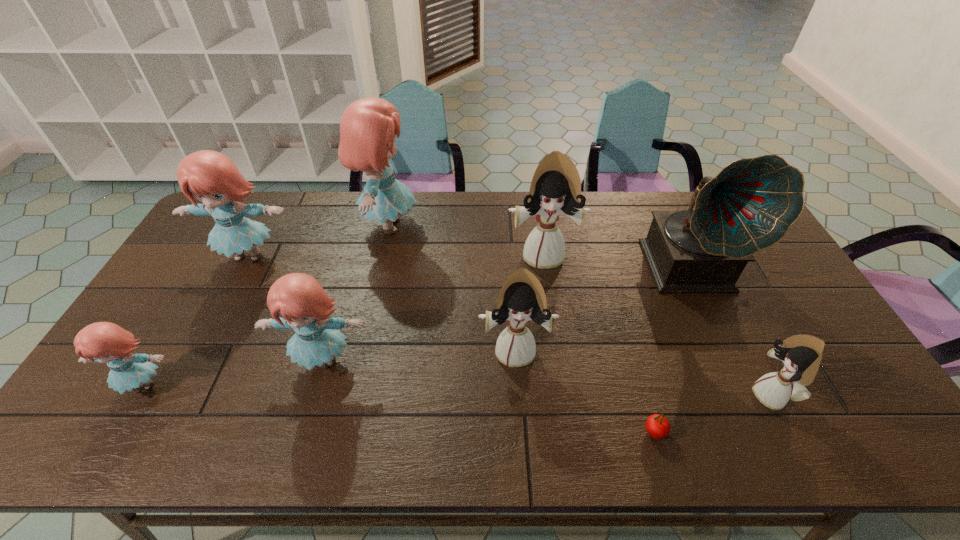
What are the coordinates of `vacant space that's between the record player and the red cherry` in the screenshot? It's located at (672, 350).

Image resolution: width=960 pixels, height=540 pixels. In order to click on vacant point located between the cherry and the smallest blue doll in this screenshot , I will do `click(398, 408)`.

Identify the location of vacant area between the nearest black doll and the third biggest blue doll. The height and width of the screenshot is (540, 960). (547, 377).

Locate an element on the screen. free space between the rightmost doll and the smallest blue doll is located at coordinates (458, 390).

At what (x,y) coordinates should I click in order to perform the action: click on unoccupied position between the second smallest black doll and the record player. Please return your answer as a coordinate pair (x, y). The width and height of the screenshot is (960, 540). Looking at the image, I should click on (604, 308).

The image size is (960, 540). I want to click on free space between the second nearest black doll and the second biggest blue doll, so click(x=382, y=303).

Where is `free space between the red cherry and the second smallest blue doll`? free space between the red cherry and the second smallest blue doll is located at coordinates (488, 396).

Identify which object is the nearest to the record player. Please provide its 2D coordinates. Your answer should be formatted as a tuple, i.e. [(x, y)], where the tuple contains the x and y coordinates of a point satisfying the conditions above.

[(555, 189)]

The image size is (960, 540). I want to click on the sixth closest object to the biggest blue doll, so click(750, 205).

Locate which doll is the fourth closest to the red cherry. Please provide its 2D coordinates. Your answer should be formatted as a tuple, i.e. [(x, y)], where the tuple contains the x and y coordinates of a point satisfying the conditions above.

[(304, 306)]